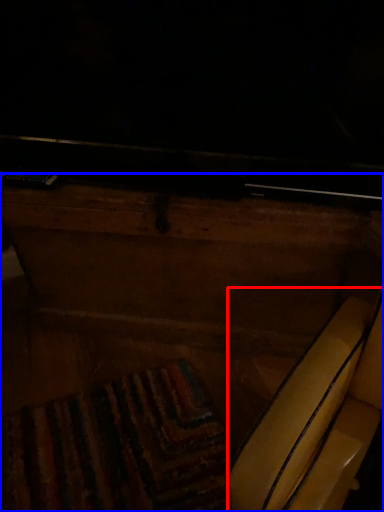
Question: Which point is closer to the camera, swivel chair (highlighted by a red box) or furniture (highlighted by a blue box)?

Choices:
 (A) swivel chair
 (B) furniture

Answer: (A)